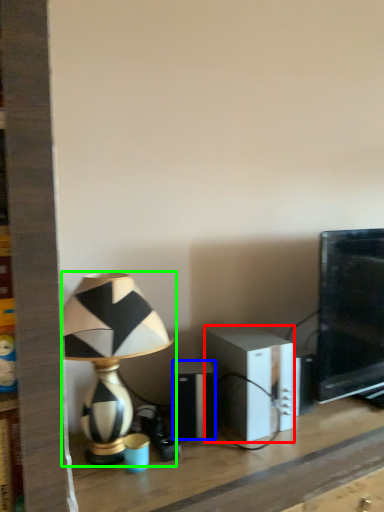
Question: Based on their relative distances, which object is nearer to speaker (highlighted by a red box)? Choose from speaker (highlighted by a blue box) and lamp (highlighted by a green box).

Choices:
 (A) speaker
 (B) lamp

Answer: (A)